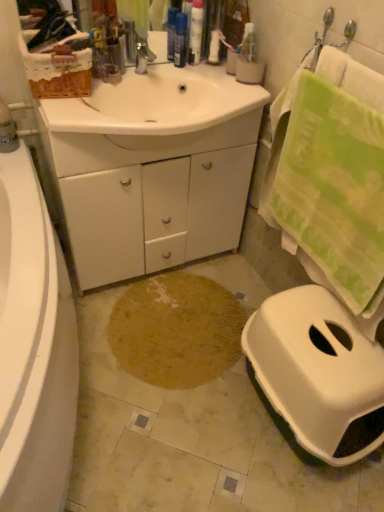
Locate an element on the screen. This screenshot has height=512, width=384. free area in between white plastic toilet at lower right and brown textured rug at center is located at coordinates (213, 428).